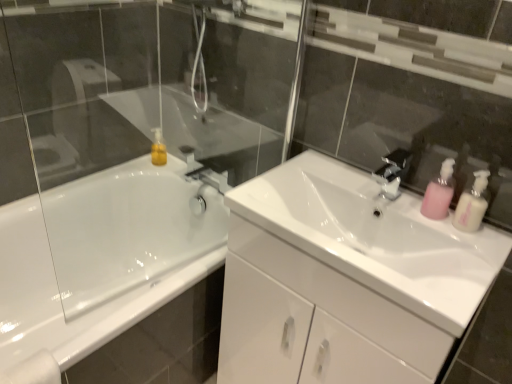
Identify the location of free space on the front side of pink plastic soap dispenser at right, the first soap dispenser viewed from the right. The image size is (512, 384). (476, 254).